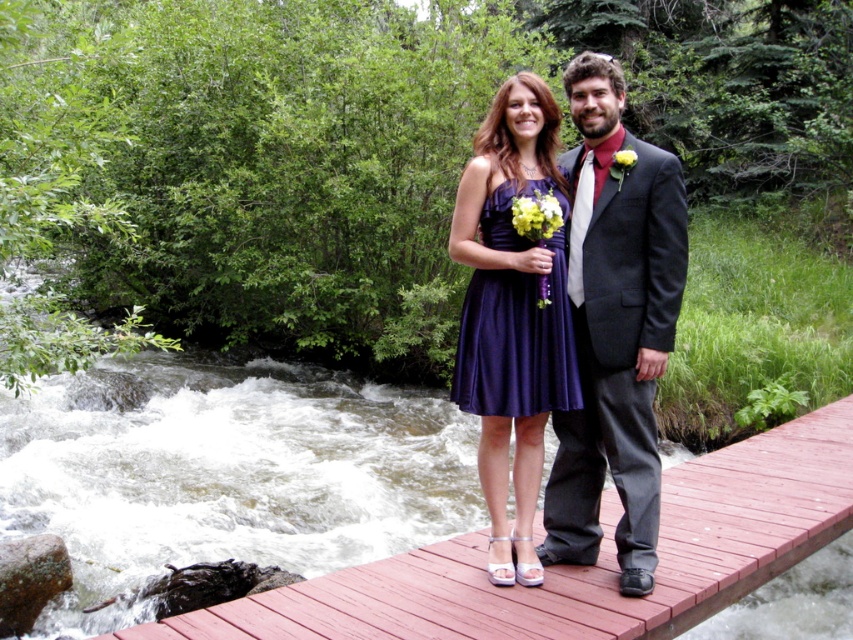
Question: Where is wooden bridge at center located in relation to yellow fabric flower at center in the image?

Choices:
 (A) above
 (B) below

Answer: (B)

Question: Among these points, which one is farthest from the camera?

Choices:
 (A) (465, 337)
 (B) (665, 541)
 (C) (547, 164)
 (D) (525, 225)

Answer: (B)

Question: Does purple satin dress at center appear on the right side of matte purple bouquet at center?

Choices:
 (A) yes
 (B) no

Answer: (B)

Question: Among these points, which one is farthest from the camera?

Choices:
 (A) (619, 161)
 (B) (525, 204)

Answer: (A)

Question: Which point appears closest to the camera in this image?

Choices:
 (A) (418, 566)
 (B) (538, 216)

Answer: (B)

Question: Is wooden bridge at center bigger than satin dress at center?

Choices:
 (A) yes
 (B) no

Answer: (A)